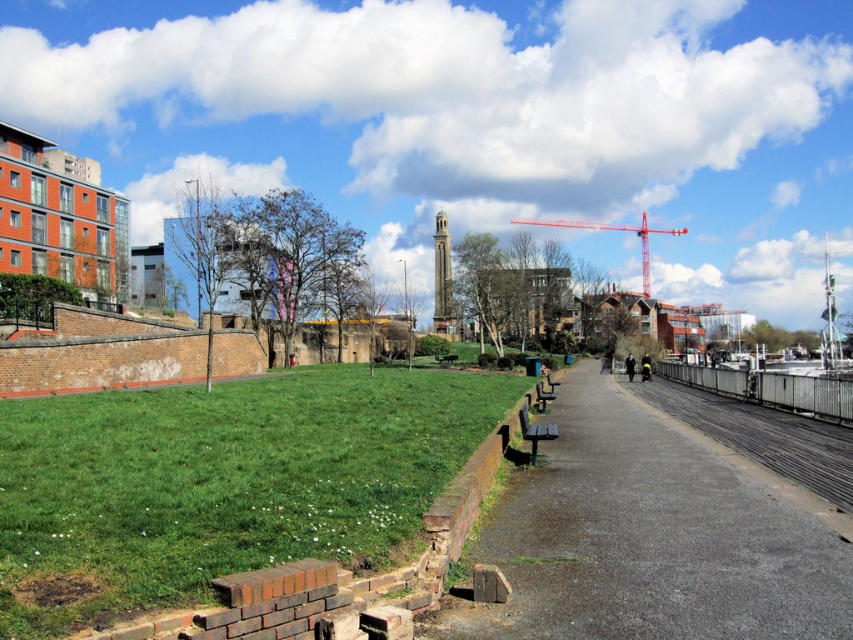
How much distance is there between green grass at lower left and asphalt pavement at center?

5.00 meters

Who is lower down, green grass at lower left or asphalt pavement at center?

asphalt pavement at center

Between point (48, 572) and point (692, 564), which one is positioned in front?

Positioned in front is point (48, 572).

Where is `green grass at lower left`? green grass at lower left is located at coordinates (222, 483).

Can you confirm if green grass at lower left is positioned above red metal crane at upper right?

Actually, green grass at lower left is below red metal crane at upper right.

Is green grass at lower left behind red metal crane at upper right?

No, green grass at lower left is in front of red metal crane at upper right.

Who is more forward, (201, 488) or (604, 221)?

Point (201, 488) is in front.

Locate an element on the screen. green grass at lower left is located at coordinates (222, 483).

How far apart are black rubber train track at right and red metal crane at upper right?

black rubber train track at right is 484.72 feet from red metal crane at upper right.

Looking at this image, can you confirm if black rubber train track at right is shorter than red metal crane at upper right?

Yes, black rubber train track at right is shorter than red metal crane at upper right.

What do you see at coordinates (764, 435) in the screenshot? I see `black rubber train track at right` at bounding box center [764, 435].

This screenshot has height=640, width=853. Identify the location of black rubber train track at right. (764, 435).